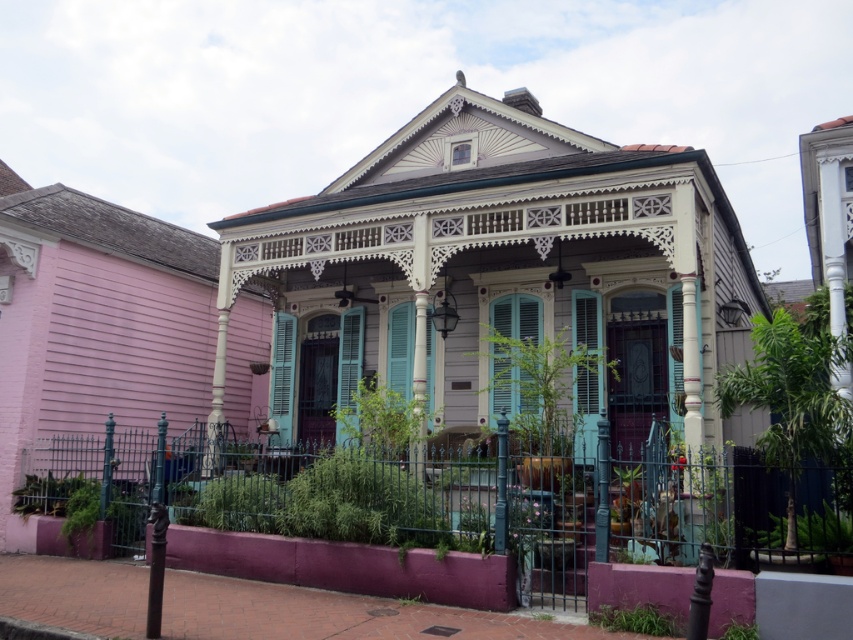
Consider the image. Does teal matte shutter at center appear under matte teal shutter at center?

Indeed, teal matte shutter at center is positioned under matte teal shutter at center.

You are a GUI agent. You are given a task and a screenshot of the screen. Output one action in this format:
    pyautogui.click(x=<x>, y=<y>)
    Task: Click on the teal matte shutter at center
    This screenshot has height=640, width=853.
    Given the screenshot: What is the action you would take?
    pyautogui.click(x=508, y=381)